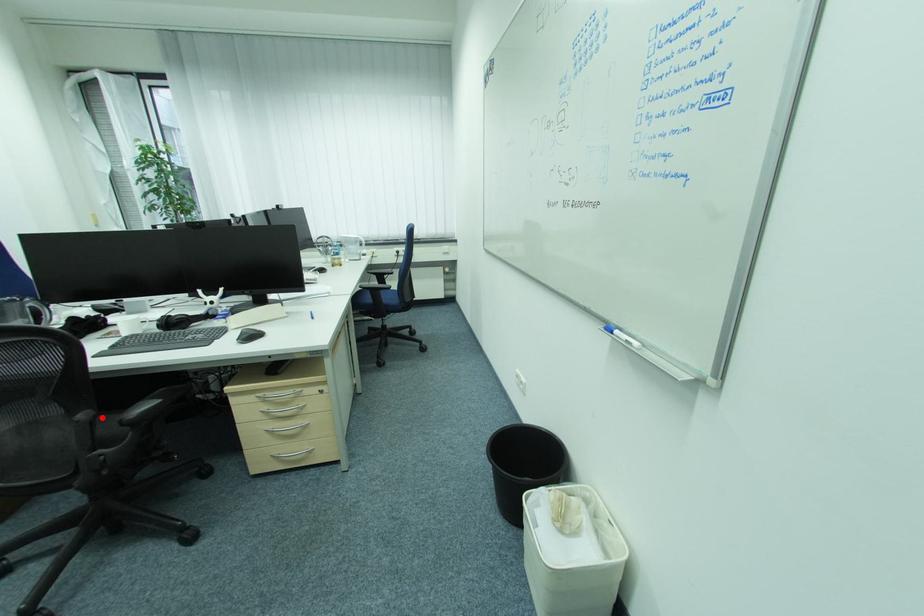
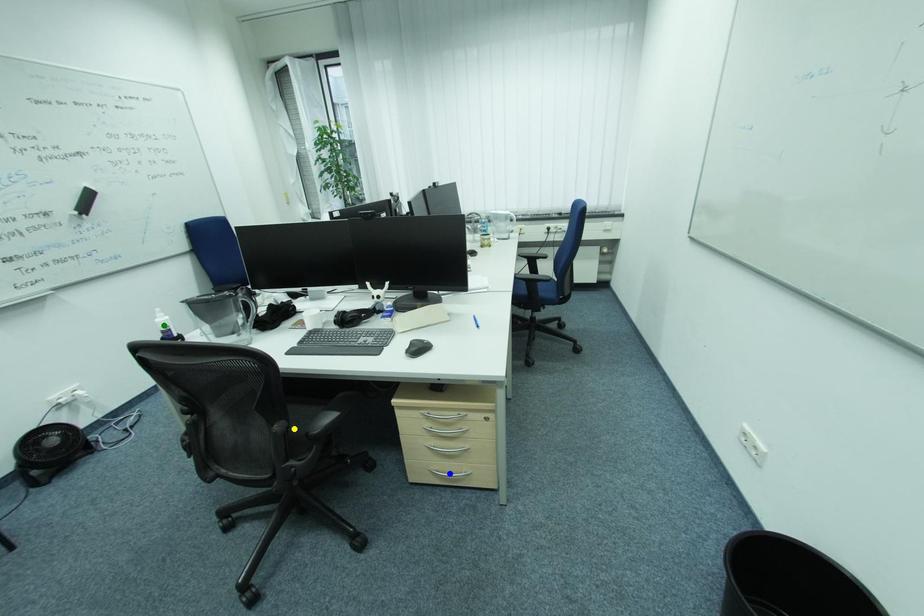
Question: I am providing you with two images of the same scene from different viewpoints. A red point is marked on the first image. You are given multiple points on the second image. Which point in image 2 is actually the same real-world point as the red point in image 1?

Choices:
 (A) yellow point
 (B) blue point
 (C) green point

Answer: (A)